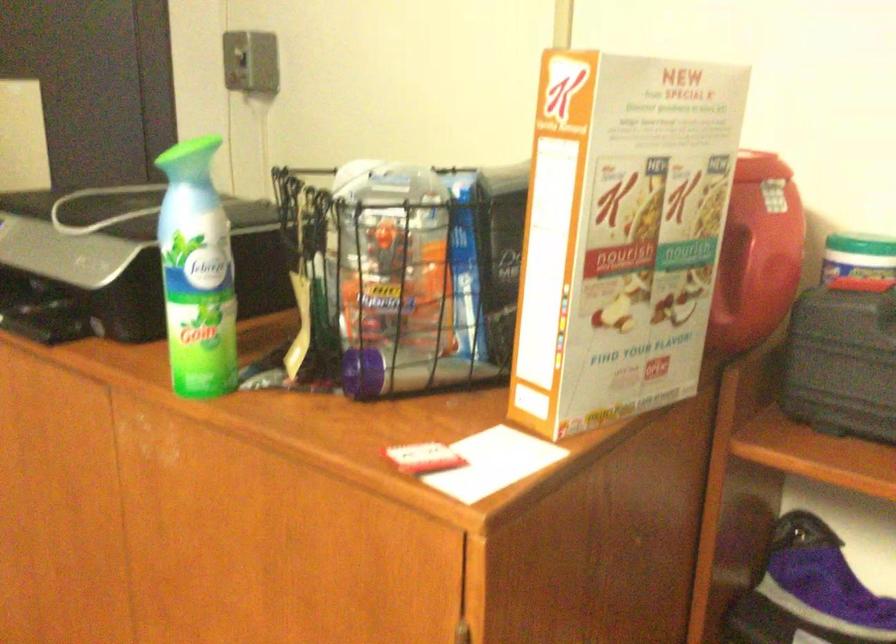
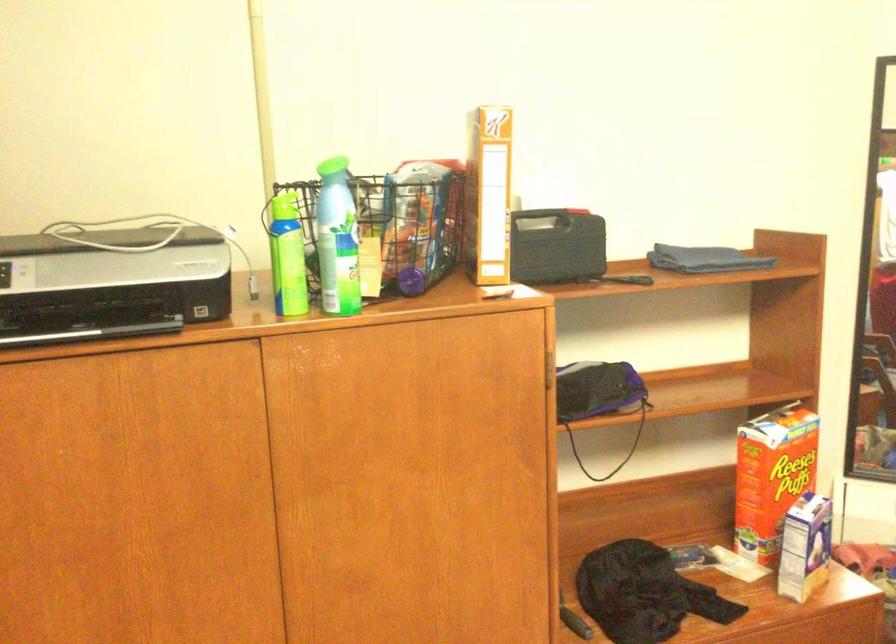
Question: I am providing you with two images of the same scene from different viewpoints. Which of the following objects are not visible in image2?

Choices:
 (A) floral patterned box
 (B) orange cereal box
 (C) small milk carton
 (D) purple shoe

Answer: (D)